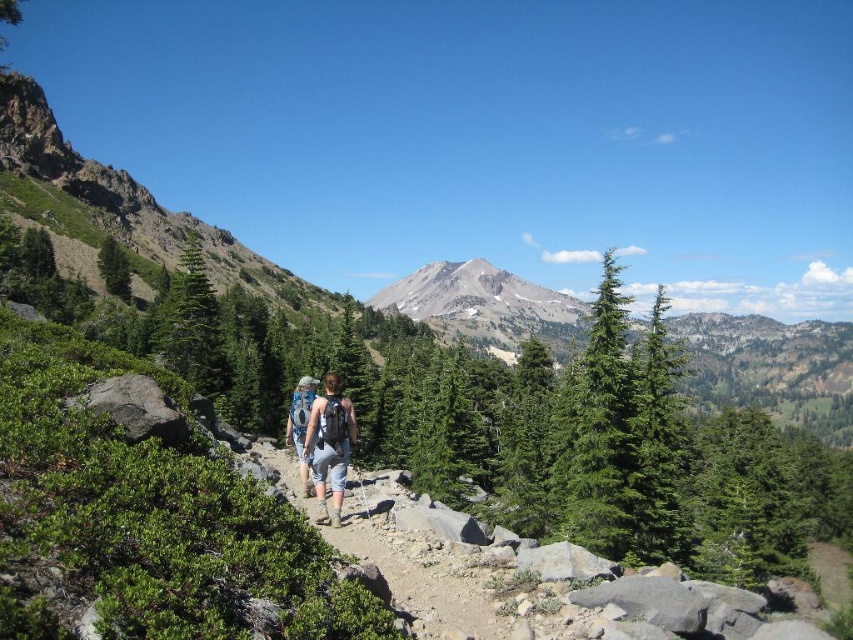
You are a hiker trying to follow the trail. You see the brown rocky trail at center and the denim shorts at center. Which direction should you move to stay on the trail?

The brown rocky trail at center is to the right of denim shorts at center. To stay on the trail, you should move towards the right direction from the denim shorts at center.

You are a hiker trying to locate the trail on a map. The map shows a coordinate point where the trail is located. What are the coordinates of the brown rocky trail at center?

The coordinates of the brown rocky trail at center are point (422, 566).